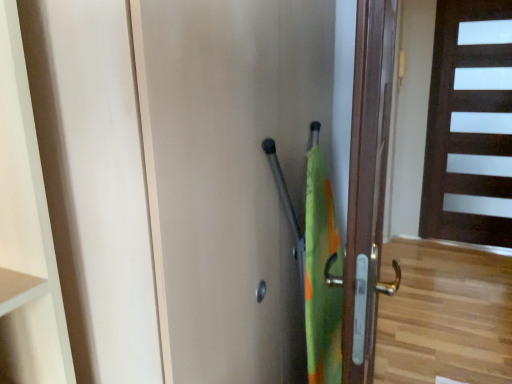
Question: Would you say dark wood door at right, acting as the first door starting from the right, is to the left or to the right of matte wood door at center, which is the first door in left-to-right order, in the picture?

Choices:
 (A) right
 (B) left

Answer: (A)

Question: From their relative heights in the image, would you say dark wood door at right, which is the third door in front-to-back order, is taller or shorter than matte wood door at center, marked as the 3th door in a right-to-left arrangement?

Choices:
 (A) short
 (B) tall

Answer: (B)

Question: Which object is positioned closest to the matte wood door at center, marked as the 3th door in a right-to-left arrangement?

Choices:
 (A) brown wooden door at right, which is the second door from right to left
 (B) dark wood door at right, acting as the first door starting from the right

Answer: (A)

Question: Which of these objects is positioned closest to the brown wooden door at right, which appears as the 2th door when viewed from the left?

Choices:
 (A) matte wood door at center, positioned as the 1th door in front-to-back order
 (B) dark wood door at right, which is counted as the third door, starting from the left

Answer: (A)